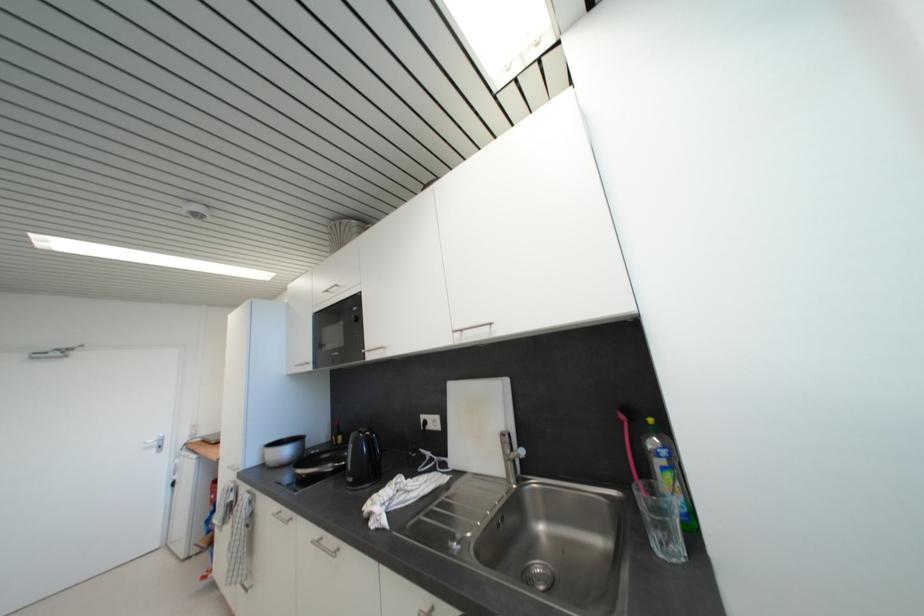
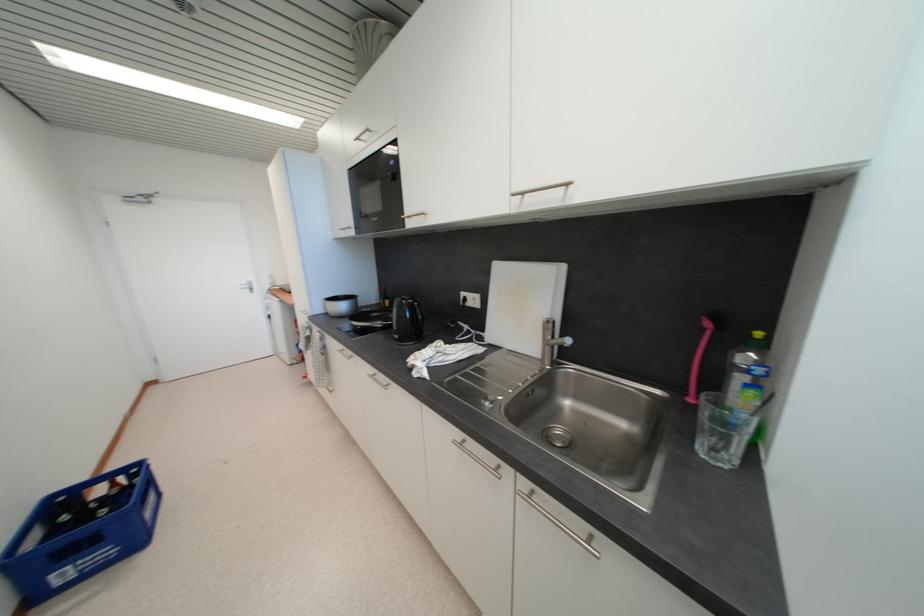
Locate, in the second image, the point that corresponds to (675,477) in the first image.

(757, 394)